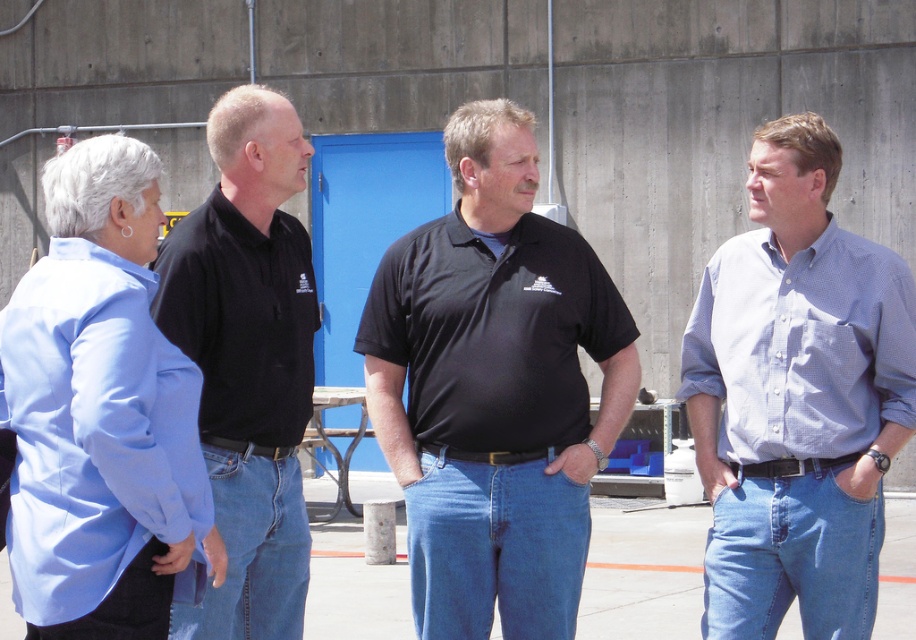
Can you confirm if black cotton polo shirt at center is positioned to the right of blue checkered shirt at right?

No, black cotton polo shirt at center is not to the right of blue checkered shirt at right.

Between black cotton polo shirt at center and blue checkered shirt at right, which one has less height?

blue checkered shirt at right is shorter.

Which is in front, point (557, 637) or point (867, 538)?

Positioned in front is point (867, 538).

Identify the location of black cotton polo shirt at center. The width and height of the screenshot is (916, 640). [x=494, y=388].

Which is behind, point (608, 438) or point (417, 298)?

The point (417, 298) is more distant.

Between black cotton polo shirt at center and black matte polo shirt at center, which one has less height?

With less height is black matte polo shirt at center.

Between point (570, 516) and point (382, 356), which one is positioned behind?

Positioned behind is point (382, 356).

You are a GUI agent. You are given a task and a screenshot of the screen. Output one action in this format:
    pyautogui.click(x=<x>, y=<y>)
    Task: Click on the black cotton polo shirt at center
    This screenshot has width=916, height=640.
    Given the screenshot: What is the action you would take?
    pyautogui.click(x=494, y=388)

Is light blue cotton shirt at left thinner than denim jeans at lower left?

Incorrect, light blue cotton shirt at left's width is not less than denim jeans at lower left's.

Is light blue cotton shirt at left bigger than denim jeans at lower left?

Yes, light blue cotton shirt at left is bigger than denim jeans at lower left.

The width and height of the screenshot is (916, 640). I want to click on light blue cotton shirt at left, so click(95, 433).

Where is `light blue cotton shirt at left`? light blue cotton shirt at left is located at coordinates (95, 433).